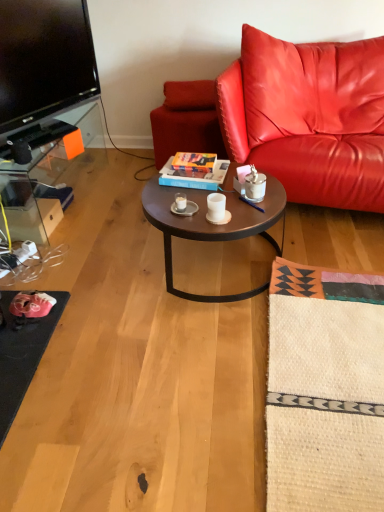
Question: From the image's perspective, would you say clear glass tv stand at left is positioned over leather couch at right?

Choices:
 (A) no
 (B) yes

Answer: (A)

Question: Considering the relative sizes of clear glass tv stand at left and leather couch at right in the image provided, is clear glass tv stand at left shorter than leather couch at right?

Choices:
 (A) yes
 (B) no

Answer: (A)

Question: Is clear glass tv stand at left wider than leather couch at right?

Choices:
 (A) yes
 (B) no

Answer: (B)

Question: Can you confirm if clear glass tv stand at left is thinner than leather couch at right?

Choices:
 (A) no
 (B) yes

Answer: (B)

Question: Can you confirm if clear glass tv stand at left is smaller than leather couch at right?

Choices:
 (A) no
 (B) yes

Answer: (B)

Question: From a real-world perspective, is clear glass tv stand at left positioned under leather couch at right based on gravity?

Choices:
 (A) yes
 (B) no

Answer: (A)

Question: Are white ceramic mug at center, which is the 1th coffee cup in back-to-front order, and matte leather swivel chair at center far apart?

Choices:
 (A) yes
 (B) no

Answer: (B)

Question: Can you confirm if white ceramic mug at center, which ranks as the 1th coffee cup in left-to-right order, is wider than matte leather swivel chair at center?

Choices:
 (A) no
 (B) yes

Answer: (A)

Question: Is white ceramic mug at center, the 2th coffee cup from the front, completely or partially outside of matte leather swivel chair at center?

Choices:
 (A) no
 (B) yes

Answer: (B)

Question: Can you confirm if white ceramic mug at center, which ranks as the 1th coffee cup in left-to-right order, is taller than matte leather swivel chair at center?

Choices:
 (A) yes
 (B) no

Answer: (B)

Question: Considering the relative sizes of white ceramic mug at center, which is the 1th coffee cup in back-to-front order, and matte leather swivel chair at center in the image provided, is white ceramic mug at center, which is the 1th coffee cup in back-to-front order, shorter than matte leather swivel chair at center?

Choices:
 (A) yes
 (B) no

Answer: (A)

Question: Is white ceramic mug at center, which is the 1th coffee cup in back-to-front order, in front of matte leather swivel chair at center?

Choices:
 (A) no
 (B) yes

Answer: (B)

Question: Does white ceramic mug at center, the 2th coffee cup from the front, have a lesser height compared to leather couch at right?

Choices:
 (A) no
 (B) yes

Answer: (B)